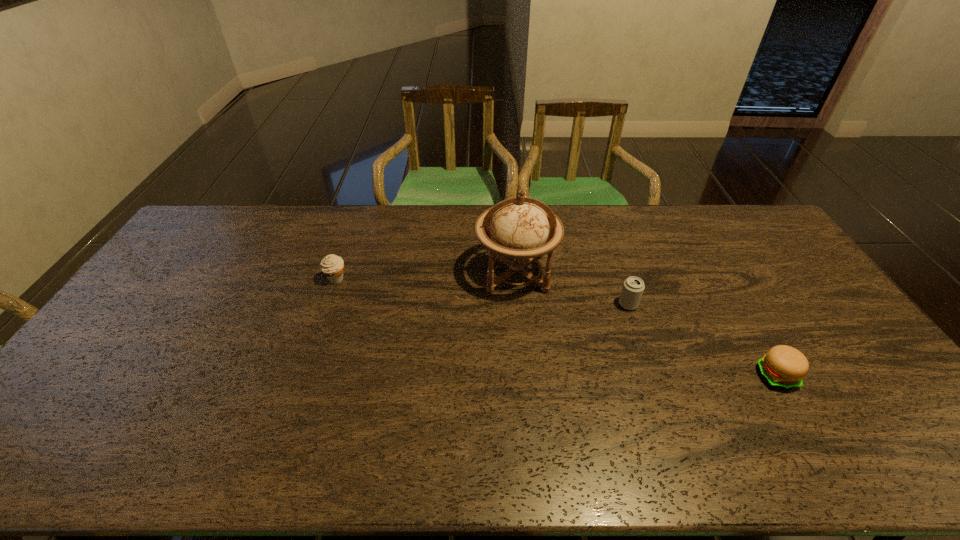
Where is `globe`? globe is located at coordinates (518, 227).

The width and height of the screenshot is (960, 540). Identify the location of the second object from left to right. (518, 227).

Where is `muffin`? Image resolution: width=960 pixels, height=540 pixels. muffin is located at coordinates (332, 266).

Where is `can`? can is located at coordinates (633, 287).

The image size is (960, 540). I want to click on hamburger, so click(x=783, y=366).

Where is `the nearest object`? This screenshot has width=960, height=540. the nearest object is located at coordinates (783, 366).

At what (x,y) coordinates should I click in order to perform the action: click on vacant space located on the front-facing side of the tallest object. Please return your answer as a coordinate pair (x, y). Image resolution: width=960 pixels, height=540 pixels. Looking at the image, I should click on (526, 390).

At what (x,y) coordinates should I click in order to perform the action: click on vacant region located on the back of the muffin. Please return your answer as a coordinate pair (x, y). The image size is (960, 540). Looking at the image, I should click on (360, 210).

Image resolution: width=960 pixels, height=540 pixels. I want to click on vacant region located 0.350m on the back of the can, so click(603, 230).

Find the location of a particular element. The image size is (960, 540). free location located on the right of the hamburger is located at coordinates [840, 376].